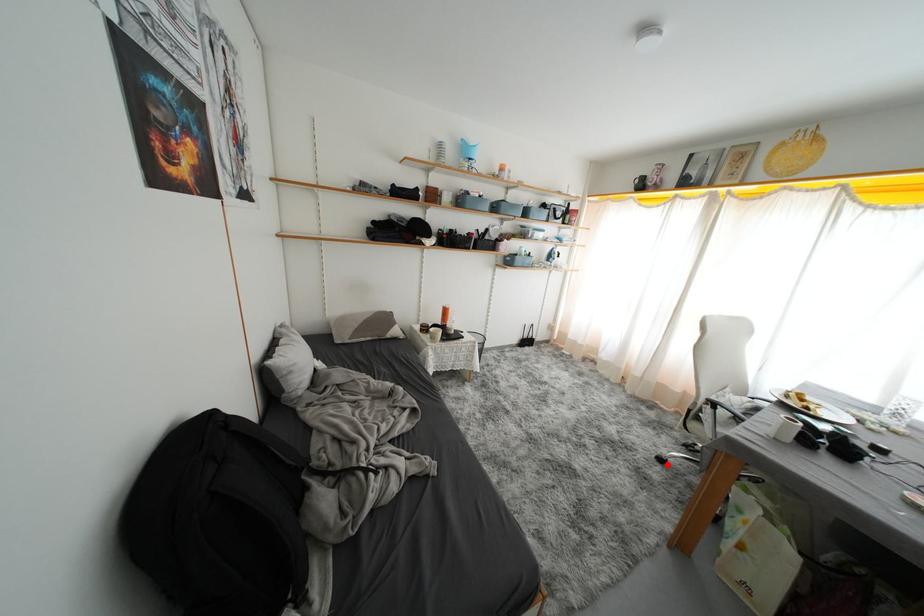
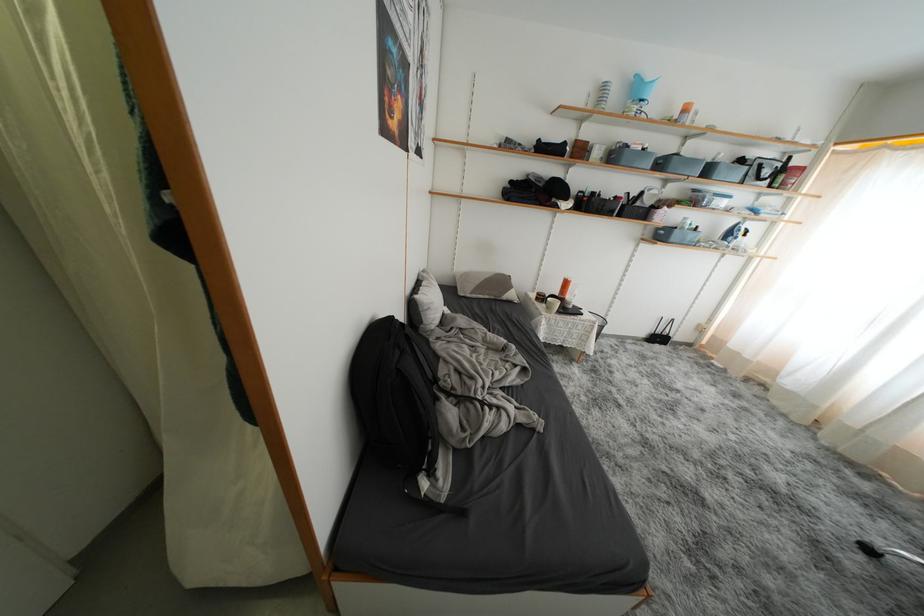
Question: A red point is marked in image1. In image2, is the corresponding 3D point closer to the camera or farther? Reply with the corresponding letter.

Choices:
 (A) The corresponding 3D point is closer.
 (B) The corresponding 3D point is farther.

Answer: (B)